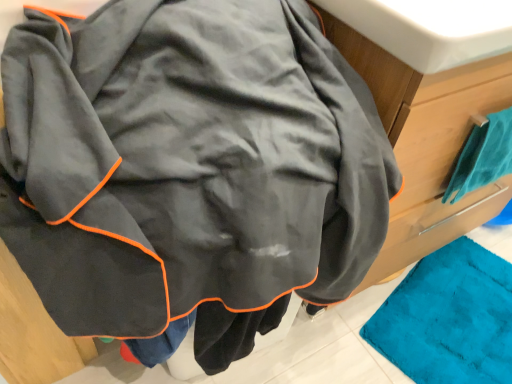
Question: Should I look upward or downward to see teal fabric towel at right?

Choices:
 (A) up
 (B) down

Answer: (A)

Question: From a real-world perspective, is teal fabric towel at right beneath white glossy sink at upper center?

Choices:
 (A) no
 (B) yes

Answer: (B)

Question: From the image's perspective, is teal fabric towel at right on white glossy sink at upper center?

Choices:
 (A) yes
 (B) no

Answer: (B)

Question: Does teal fabric towel at right have a greater height compared to white glossy sink at upper center?

Choices:
 (A) no
 (B) yes

Answer: (B)

Question: Does teal fabric towel at right have a lesser width compared to white glossy sink at upper center?

Choices:
 (A) no
 (B) yes

Answer: (B)

Question: Are teal fabric towel at right and white glossy sink at upper center located far from each other?

Choices:
 (A) yes
 (B) no

Answer: (B)

Question: Considering the relative positions of teal fabric towel at right and white glossy sink at upper center in the image provided, is teal fabric towel at right to the right of white glossy sink at upper center from the viewer's perspective?

Choices:
 (A) yes
 (B) no

Answer: (A)

Question: Is white glossy sink at upper center directly adjacent to teal fabric towel at right?

Choices:
 (A) no
 (B) yes

Answer: (A)

Question: Can you confirm if white glossy sink at upper center is taller than teal fabric towel at right?

Choices:
 (A) yes
 (B) no

Answer: (B)

Question: Could you tell me if white glossy sink at upper center is turned towards teal fabric towel at right?

Choices:
 (A) no
 (B) yes

Answer: (A)

Question: Can you confirm if white glossy sink at upper center is thinner than teal fabric towel at right?

Choices:
 (A) no
 (B) yes

Answer: (A)

Question: Would you say white glossy sink at upper center is outside teal fabric towel at right?

Choices:
 (A) no
 (B) yes

Answer: (B)

Question: Does white glossy sink at upper center have a greater width compared to teal fabric towel at right?

Choices:
 (A) yes
 (B) no

Answer: (A)

Question: In terms of height, does teal fabric towel at right look taller or shorter compared to white glossy sink at upper center?

Choices:
 (A) tall
 (B) short

Answer: (A)